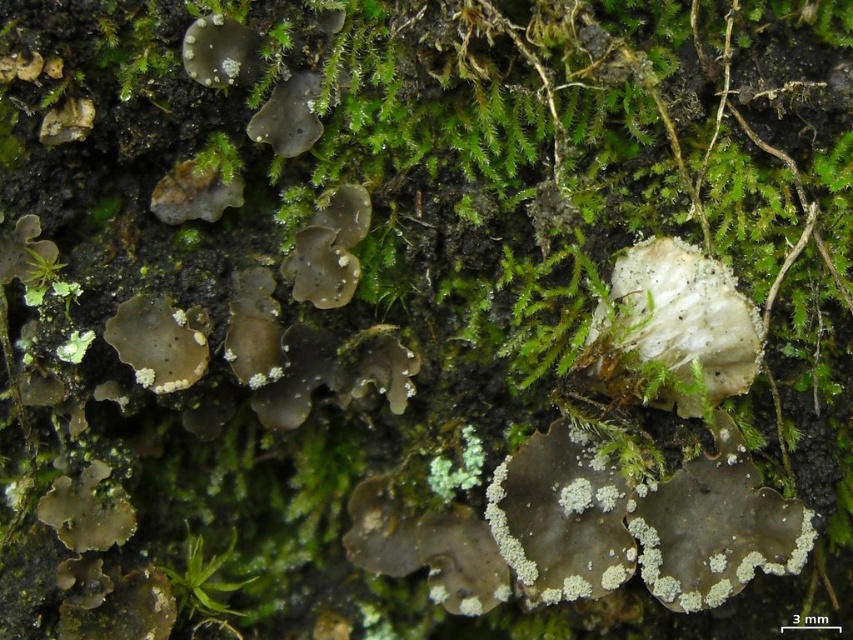
Can you confirm if translucent gelatinous lichen at lower left is positioned to the left of brown matte rock at upper left?

Correct, you'll find translucent gelatinous lichen at lower left to the left of brown matte rock at upper left.

Is translucent gelatinous lichen at lower left below brown matte rock at upper left?

Yes, translucent gelatinous lichen at lower left is below brown matte rock at upper left.

Between point (143, 307) and point (190, 182), which one is positioned behind?

The point (190, 182) is more distant.

The image size is (853, 640). I want to click on translucent gelatinous lichen at lower left, so click(158, 342).

Who is positioned more to the left, white crustose lichen at center or translucent gelatinous lichen at lower left?

From the viewer's perspective, translucent gelatinous lichen at lower left appears more on the left side.

Looking at this image, can you confirm if white crustose lichen at center is positioned to the left of translucent gelatinous lichen at lower left?

No, white crustose lichen at center is not to the left of translucent gelatinous lichen at lower left.

Is point (537, 465) more distant than point (190, 378)?

Yes, point (537, 465) is farther from viewer.

At what (x,y) coordinates should I click in order to perform the action: click on white crustose lichen at center. Please return your answer as a coordinate pair (x, y). Looking at the image, I should click on (560, 518).

Consider the image. Who is positioned more to the left, white powdery rock at center or green leafy plant at lower left?

Positioned to the left is green leafy plant at lower left.

Does point (704, 282) come farther from viewer compared to point (195, 540)?

No, it is not.

Is point (747, 381) closer to camera compared to point (187, 556)?

Yes.

This screenshot has height=640, width=853. Find the location of `white powdery rock at center`. white powdery rock at center is located at coordinates (682, 316).